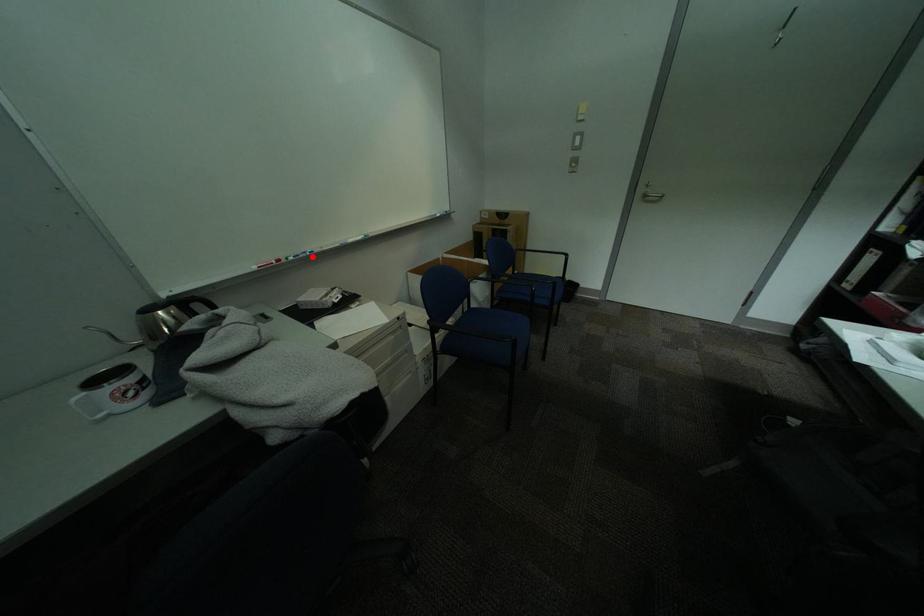
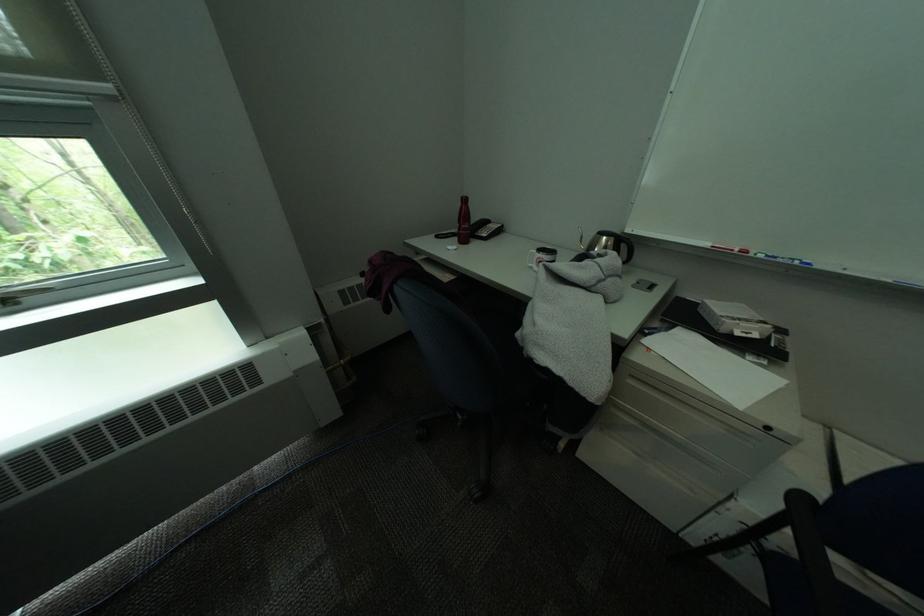
The point at the highlighted location is marked in the first image. Where is the corresponding point in the second image?

(791, 262)